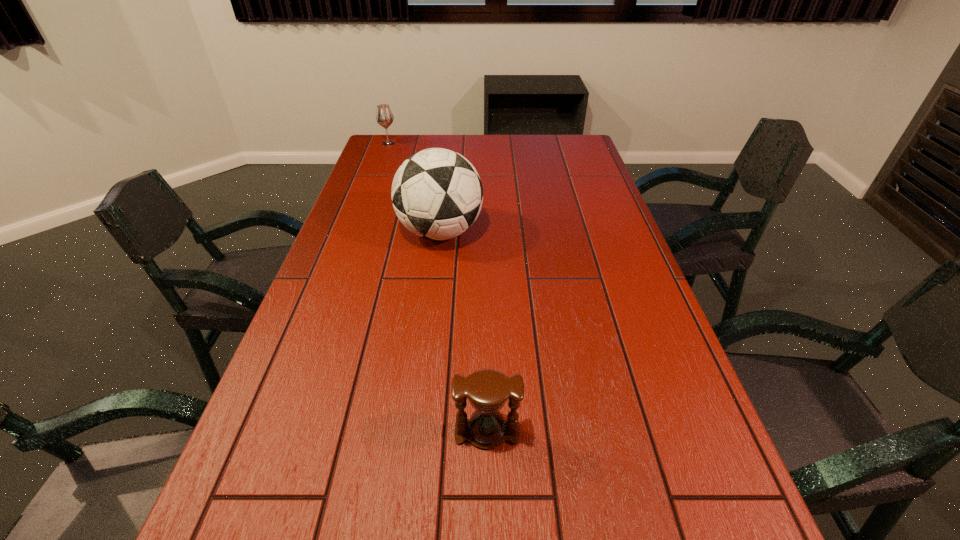
Choose which object is the nearest neighbor to the farthest object. Please provide its 2D coordinates. Your answer should be formatted as a tuple, i.e. [(x, y)], where the tuple contains the x and y coordinates of a point satisfying the conditions above.

[(437, 194)]

I want to click on the second closest object relative to the tallest object, so click(487, 390).

Where is `free location that satisfies the following two spatial constraints: 1. on the surface of the tallest object where the brand logo is visible; 2. on the left side of the nearest object`? The height and width of the screenshot is (540, 960). free location that satisfies the following two spatial constraints: 1. on the surface of the tallest object where the brand logo is visible; 2. on the left side of the nearest object is located at coordinates (417, 432).

What are the coordinates of `free space in the image that satisfies the following two spatial constraints: 1. on the back side of the nearest object; 2. on the surface of the soccer ball where the brand logo is visible` in the screenshot? It's located at tap(485, 232).